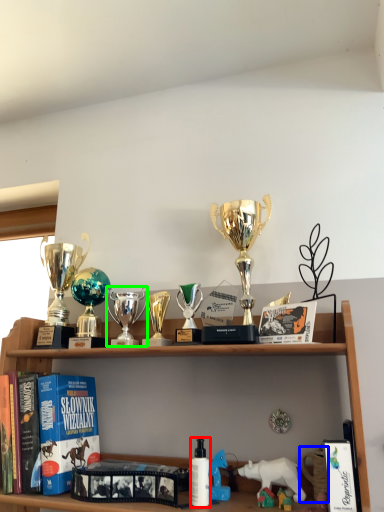
Question: Considering the real-world distances, which object is farthest from toiletry (highlighted by a red box)? toy (highlighted by a blue box) or toy (highlighted by a green box)?

Choices:
 (A) toy
 (B) toy

Answer: (B)